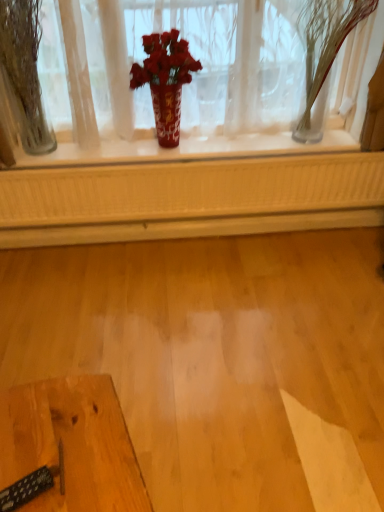
Question: Does clear glass vase at upper right, acting as the 2th tree starting from the left, have a lesser width compared to wooden table at lower left?

Choices:
 (A) yes
 (B) no

Answer: (A)

Question: Can you confirm if clear glass vase at upper right, which is the 1th tree in right-to-left order, is wider than wooden table at lower left?

Choices:
 (A) yes
 (B) no

Answer: (B)

Question: Can you confirm if clear glass vase at upper right, acting as the 2th tree starting from the left, is smaller than wooden table at lower left?

Choices:
 (A) yes
 (B) no

Answer: (A)

Question: Does clear glass vase at upper right, which is the 1th tree in right-to-left order, lie in front of wooden table at lower left?

Choices:
 (A) yes
 (B) no

Answer: (B)

Question: Would you consider clear glass vase at upper right, which is the 1th tree in right-to-left order, to be distant from wooden table at lower left?

Choices:
 (A) no
 (B) yes

Answer: (B)

Question: Is clear glass vase at upper right, acting as the 2th tree starting from the left, in front of or behind clear glass vase at left, which ranks as the second tree in right-to-left order, in the image?

Choices:
 (A) behind
 (B) front

Answer: (B)

Question: Considering the positions of clear glass vase at upper right, which is the 1th tree in right-to-left order, and clear glass vase at left, which is the 1th tree from left to right, in the image, is clear glass vase at upper right, which is the 1th tree in right-to-left order, wider or thinner than clear glass vase at left, which is the 1th tree from left to right,?

Choices:
 (A) thin
 (B) wide

Answer: (B)

Question: Choose the correct answer: Is clear glass vase at upper right, acting as the 2th tree starting from the left, inside clear glass vase at left, which ranks as the second tree in right-to-left order, or outside it?

Choices:
 (A) outside
 (B) inside

Answer: (A)

Question: In terms of size, does clear glass vase at upper right, acting as the 2th tree starting from the left, appear bigger or smaller than clear glass vase at left, which is the 1th tree from left to right?

Choices:
 (A) small
 (B) big

Answer: (B)

Question: From the image's perspective, is clear glass vase at upper right, which is the 1th tree in right-to-left order, positioned above or below wooden table at lower left?

Choices:
 (A) above
 (B) below

Answer: (A)

Question: Considering the positions of clear glass vase at upper right, acting as the 2th tree starting from the left, and wooden table at lower left in the image, is clear glass vase at upper right, acting as the 2th tree starting from the left, taller or shorter than wooden table at lower left?

Choices:
 (A) short
 (B) tall

Answer: (B)

Question: Looking at the image, does clear glass vase at upper right, acting as the 2th tree starting from the left, seem bigger or smaller compared to wooden table at lower left?

Choices:
 (A) big
 (B) small

Answer: (B)

Question: Is point (321, 84) positioned closer to the camera than point (44, 444)?

Choices:
 (A) closer
 (B) farther

Answer: (B)

Question: Considering the positions of red glossy vase at center and clear glass vase at left, which is the 1th tree from left to right, in the image, is red glossy vase at center taller or shorter than clear glass vase at left, which is the 1th tree from left to right,?

Choices:
 (A) tall
 (B) short

Answer: (B)

Question: Does point (357, 80) appear closer or farther from the camera than point (0, 78)?

Choices:
 (A) closer
 (B) farther

Answer: (B)